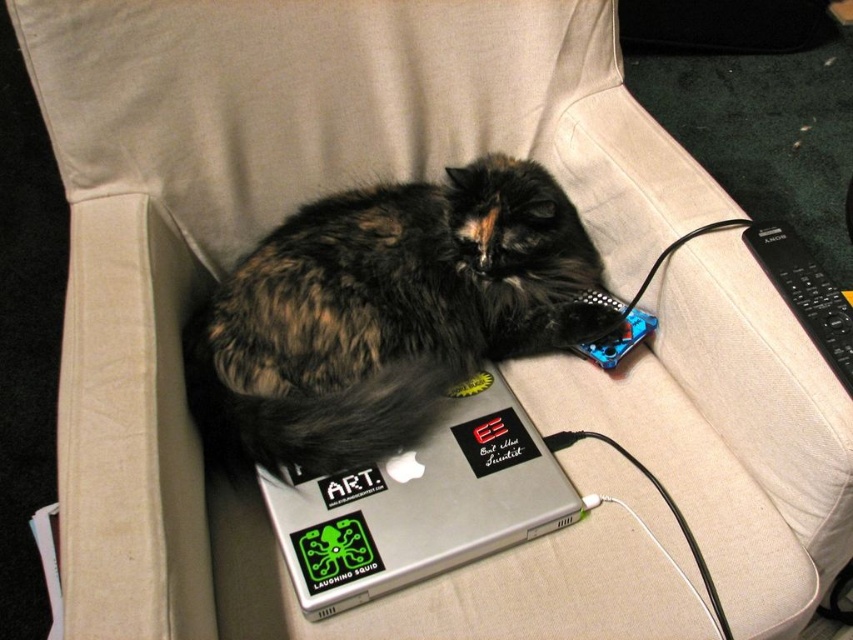
Question: Does fluffy fur cat at center appear under silver metallic laptop at center?

Choices:
 (A) yes
 (B) no

Answer: (B)

Question: Which of the following is the closest to the observer?

Choices:
 (A) fluffy fur cat at center
 (B) black plastic remote at right

Answer: (B)

Question: Can you confirm if fluffy fur cat at center is positioned to the right of black plastic remote at right?

Choices:
 (A) no
 (B) yes

Answer: (A)

Question: Does fluffy fur cat at center lie in front of black plastic remote at right?

Choices:
 (A) no
 (B) yes

Answer: (A)

Question: Which is farther from the fluffy fur cat at center?

Choices:
 (A) silver metallic laptop at center
 (B) black plastic remote at right

Answer: (B)

Question: Among these objects, which one is farthest from the camera?

Choices:
 (A) silver metallic laptop at center
 (B) black plastic remote at right

Answer: (A)